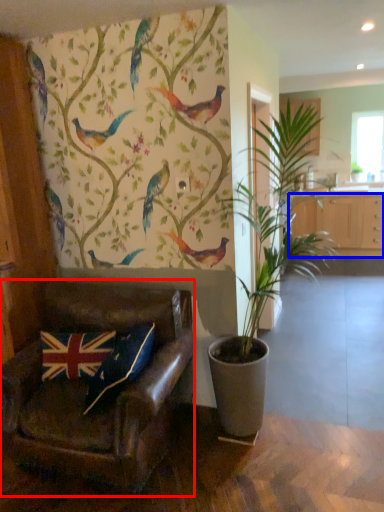
Question: Among these objects, which one is farthest to the camera, chair (highlighted by a red box) or cabinetry (highlighted by a blue box)?

Choices:
 (A) chair
 (B) cabinetry

Answer: (B)